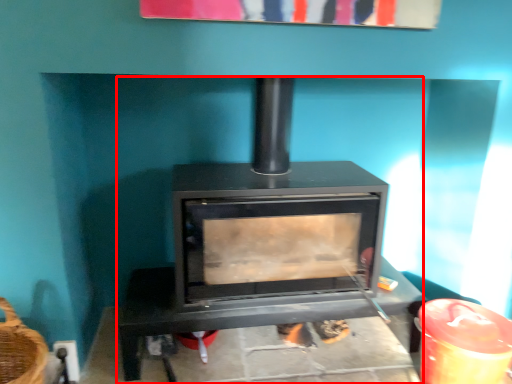
Question: Where is wood burning stove (annotated by the red box) located in relation to furniture in the image?

Choices:
 (A) right
 (B) left

Answer: (B)